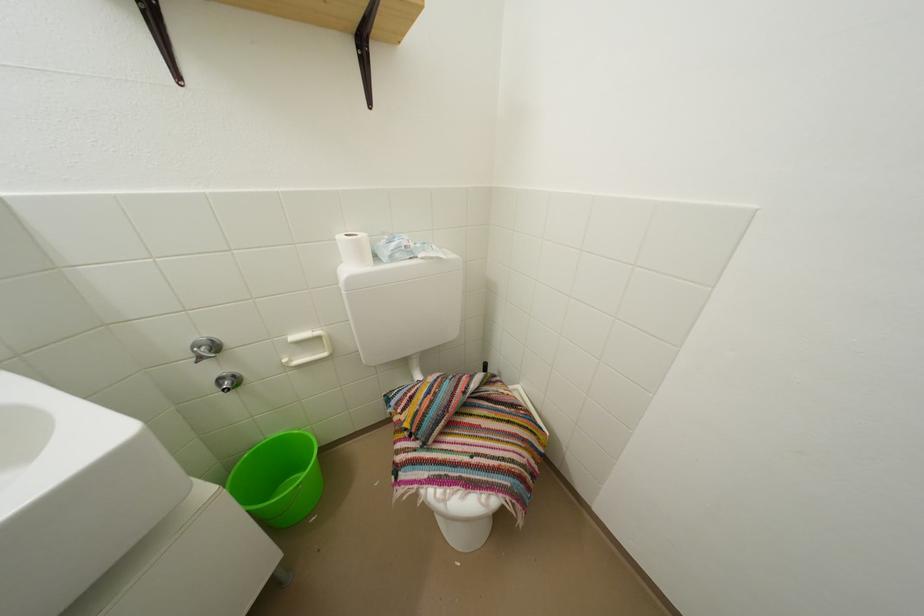
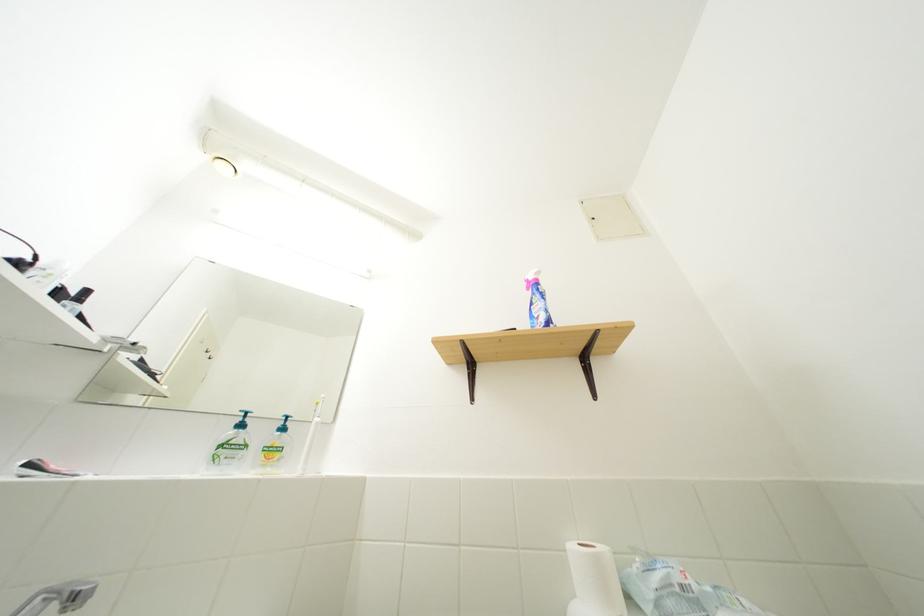
The point at [370,240] is marked in the first image. Where is the corresponding point in the second image?

(609, 554)